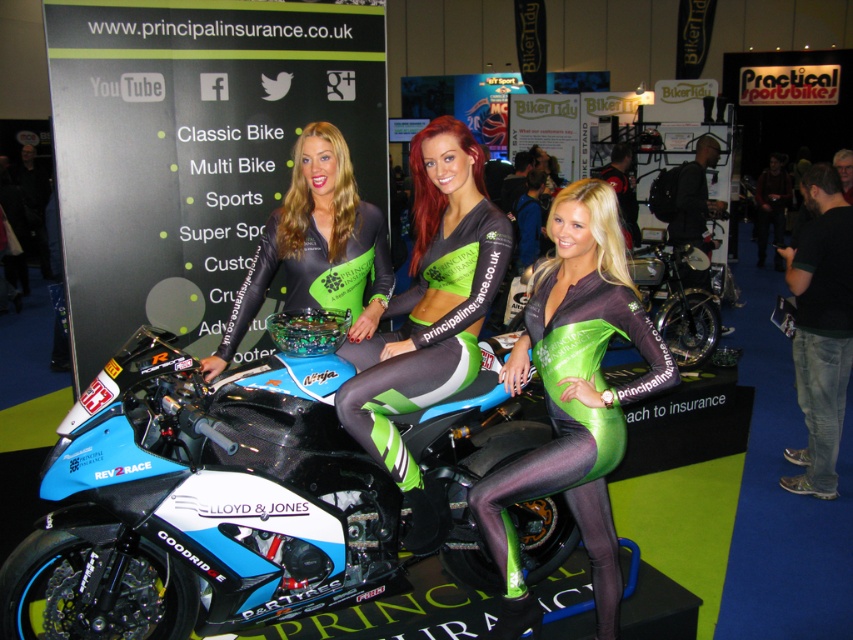
Question: Does blue carbon fiber motorcycle at center appear over green shiny bodysuit at center?

Choices:
 (A) yes
 (B) no

Answer: (B)

Question: Which object appears farthest from the camera in this image?

Choices:
 (A) green matte jersey at center
 (B) blue carbon fiber motorcycle at center
 (C) green shiny bodysuit at center

Answer: (A)

Question: In this image, where is green shiny bodysuit at center located relative to matte black motorcycle at center?

Choices:
 (A) below
 (B) above

Answer: (A)

Question: Is blue carbon fiber motorcycle at center closer to the viewer compared to green matte leggings at center?

Choices:
 (A) yes
 (B) no

Answer: (A)

Question: Which object is positioned closest to the green matte leggings at center?

Choices:
 (A) blue carbon fiber motorcycle at center
 (B) green shiny bodysuit at center

Answer: (B)

Question: Which of these objects is positioned closest to the green matte leggings at center?

Choices:
 (A) green matte jersey at center
 (B) matte black motorcycle at center
 (C) green shiny bodysuit at center

Answer: (A)